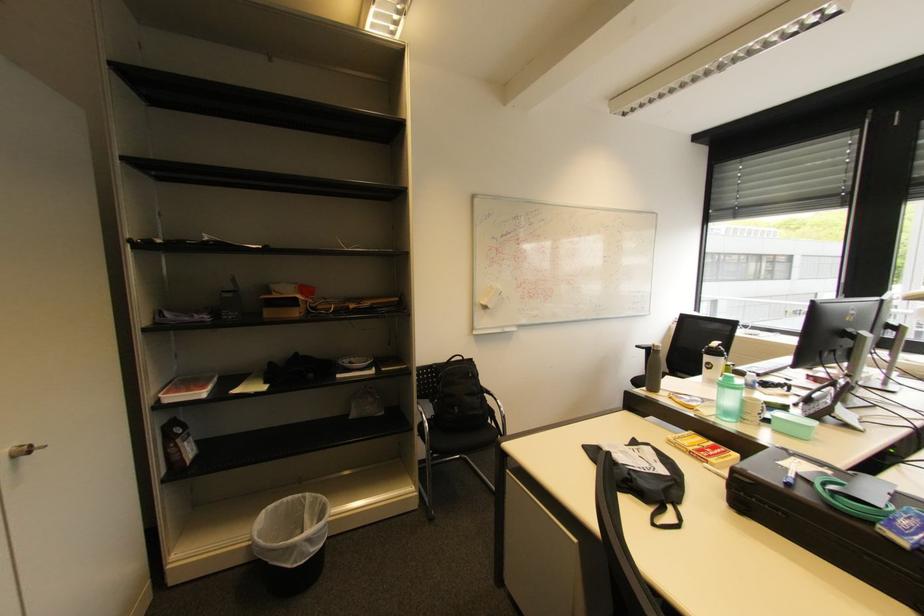
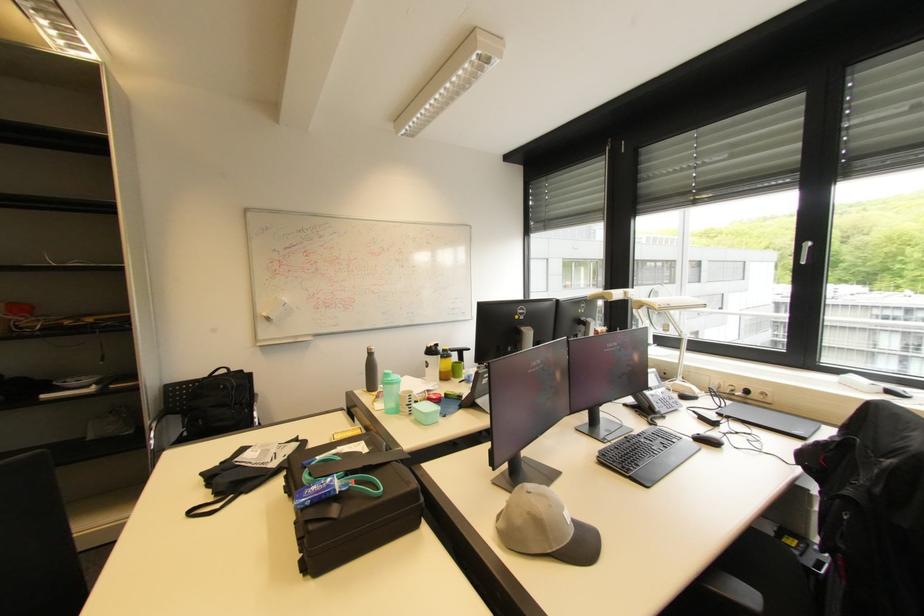
In the second image, find the point that corresponds to [738,383] in the first image.

(394, 379)